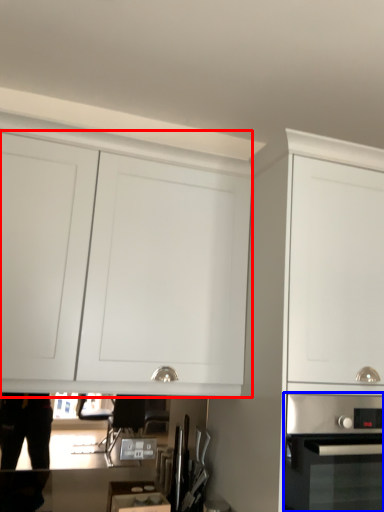
Question: Which object is closer to the camera taking this photo, cabinetry (highlighted by a red box) or home appliance (highlighted by a blue box)?

Choices:
 (A) cabinetry
 (B) home appliance

Answer: (B)